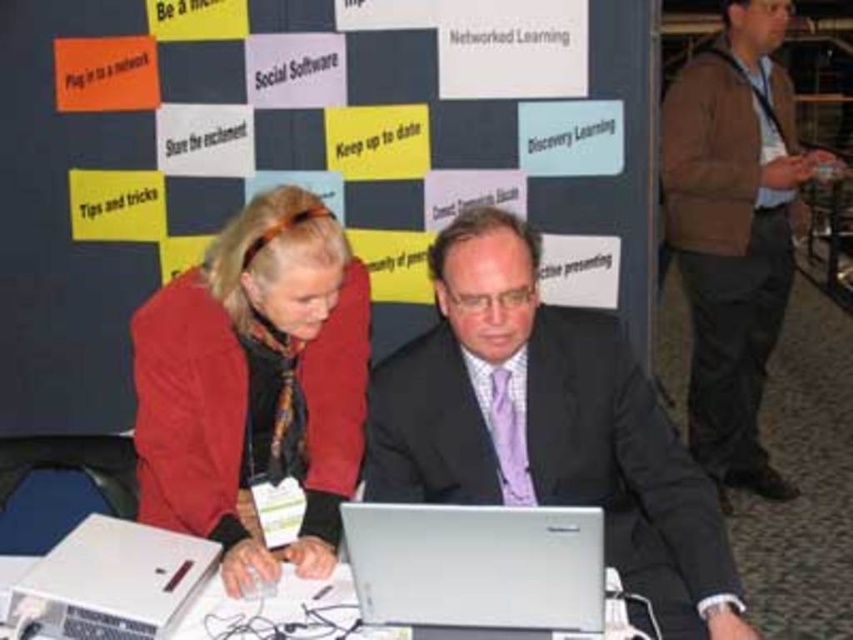
Question: Among these objects, which one is farthest from the camera?

Choices:
 (A) silver metallic laptop at center
 (B) matte black board at center
 (C) silver metallic table at center
 (D) matte black suit at center

Answer: (B)

Question: Is matte black board at center below brown woolen sweater at center?

Choices:
 (A) no
 (B) yes

Answer: (A)

Question: Does matte black suit at center appear over matte red jacket at center?

Choices:
 (A) yes
 (B) no

Answer: (B)

Question: Which point appears farthest from the camera in this image?

Choices:
 (A) (717, 80)
 (B) (386, 531)
 (C) (494, 232)
 (D) (19, 595)

Answer: (A)

Question: Which object is the closest to the silver metallic laptop at center?

Choices:
 (A) matte red jacket at center
 (B) silver metallic table at center
 (C) brown woolen sweater at center

Answer: (B)

Question: Does matte black suit at center lie behind brown woolen sweater at center?

Choices:
 (A) yes
 (B) no

Answer: (B)